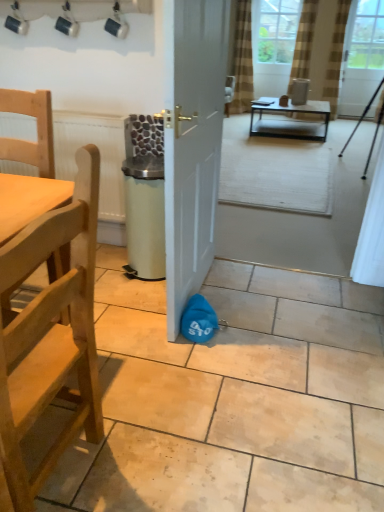
Locate an element on the screen. This screenshot has height=512, width=384. vacant area that lies between white glossy door at center and wooden chair at left, placed as the second chair when sorted from top to bottom is located at coordinates (130, 358).